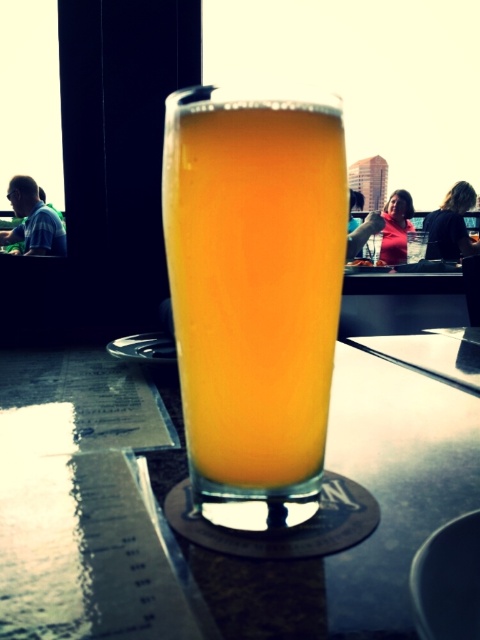
Question: Observing the image, what is the correct spatial positioning of transparent glass at center in reference to translucent glass beer at center?

Choices:
 (A) above
 (B) below

Answer: (B)

Question: From the image, what is the correct spatial relationship of transparent glass at center in relation to translucent glass beer at center?

Choices:
 (A) right
 (B) left

Answer: (B)

Question: Is transparent glass at center to the right of translucent glass beer at center from the viewer's perspective?

Choices:
 (A) yes
 (B) no

Answer: (B)

Question: Which point appears farthest from the camera in this image?

Choices:
 (A) (239, 136)
 (B) (131, 490)

Answer: (B)

Question: Which object is farther from the camera taking this photo?

Choices:
 (A) transparent glass at center
 (B) translucent glass beer at center

Answer: (B)